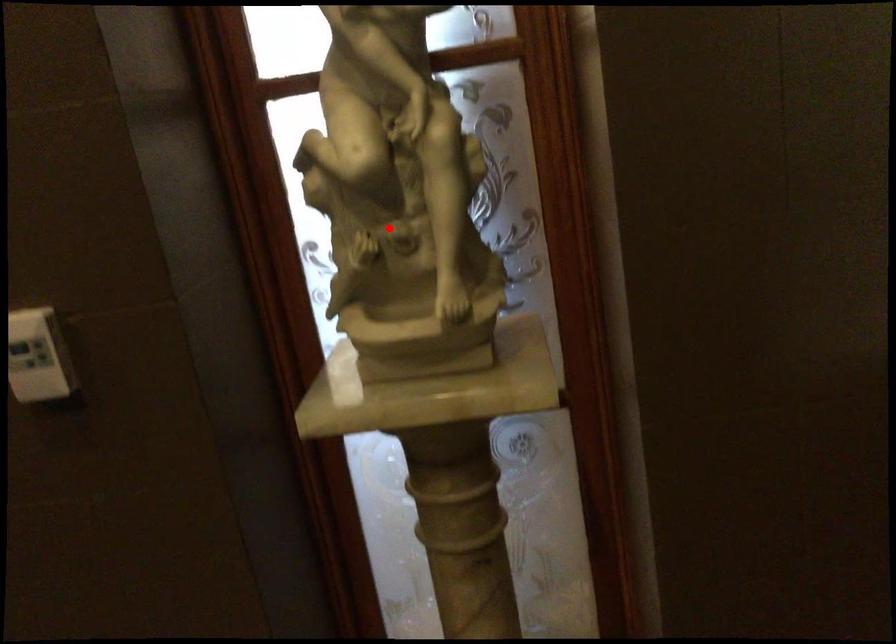
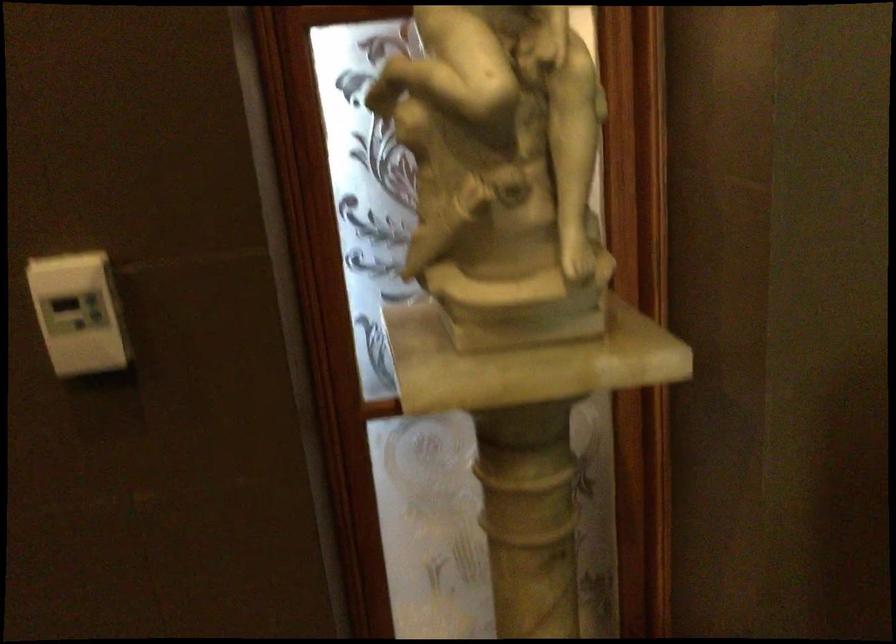
Question: I am providing you with two images of the same scene from different viewpoints. In image1, a red point is highlighted. Considering the same 3D point in image2, which of the following is correct?

Choices:
 (A) It is closer
 (B) It is farther

Answer: (A)